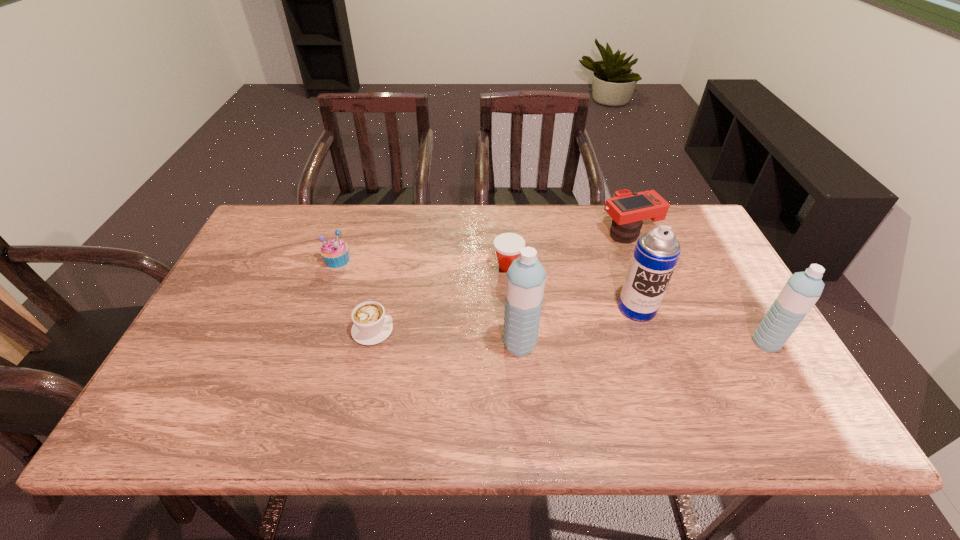
Where is `object that is at the far right corner`? The width and height of the screenshot is (960, 540). object that is at the far right corner is located at coordinates (628, 210).

In the image, there is a desktop. Identify the location of vacant space at the far edge. The width and height of the screenshot is (960, 540). (459, 220).

In the image, there is a desktop. What are the coordinates of `free space at the near edge` in the screenshot? It's located at (556, 384).

You are a GUI agent. You are given a task and a screenshot of the screen. Output one action in this format:
    pyautogui.click(x=<x>, y=<y>)
    Task: Click on the vacant space at the left edge of the desktop
    This screenshot has height=540, width=960.
    Given the screenshot: What is the action you would take?
    pyautogui.click(x=242, y=298)

This screenshot has height=540, width=960. What are the coordinates of `vacant space at the right edge` in the screenshot? It's located at (686, 298).

Identify the location of vacant space at the far right corner. (678, 217).

Locate an element on the screen. free space at the near right corner is located at coordinates (778, 383).

The width and height of the screenshot is (960, 540). Identify the location of vacant space in between the muffin and the Dixie cup. (422, 263).

Identify the location of vacant area that lies between the leftmost object and the camera. (483, 247).

You are a GUI agent. You are given a task and a screenshot of the screen. Output one action in this format:
    pyautogui.click(x=<x>, y=<y>)
    Task: Click on the free space between the rightmost object and the leftmost object
    This screenshot has width=960, height=540.
    Given the screenshot: What is the action you would take?
    pyautogui.click(x=551, y=301)